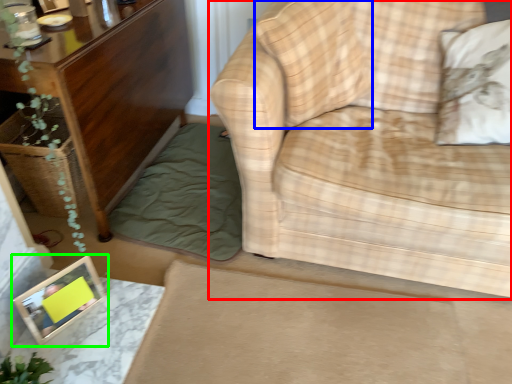
Question: Which is nearer to the studio couch (highlighted by a red box)? pillow (highlighted by a blue box) or picture frame (highlighted by a green box).

Choices:
 (A) pillow
 (B) picture frame

Answer: (A)